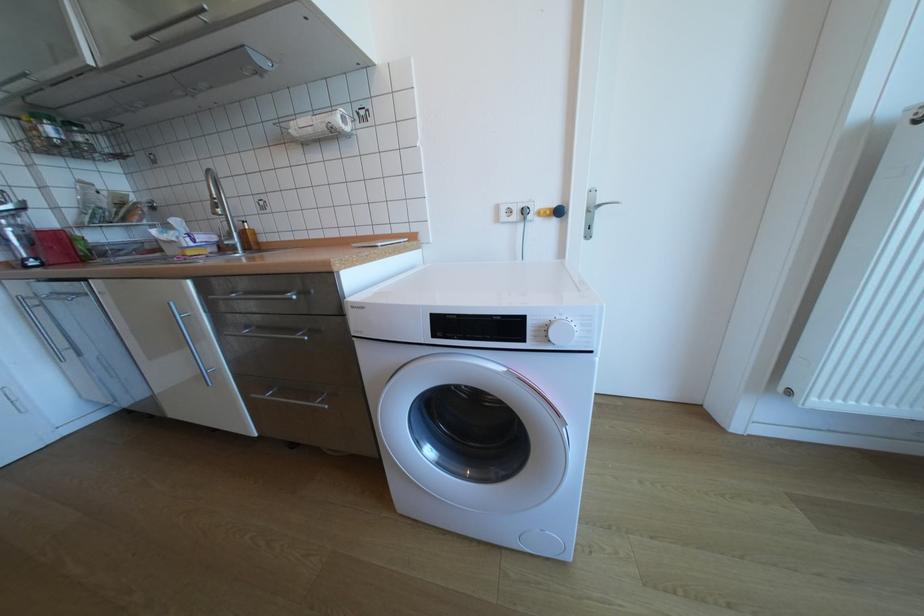
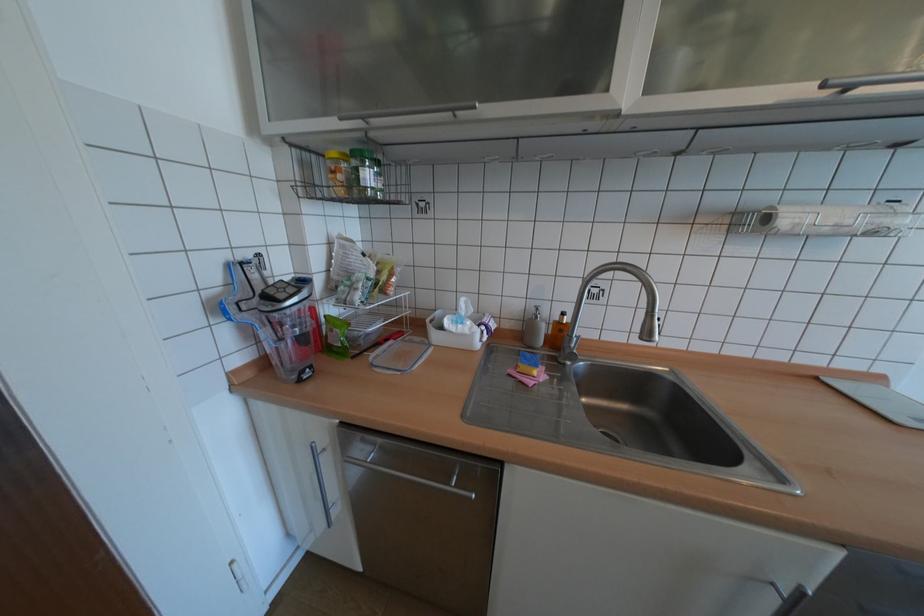
In the second image, find the point that corresponds to (176,235) in the first image.

(468, 326)